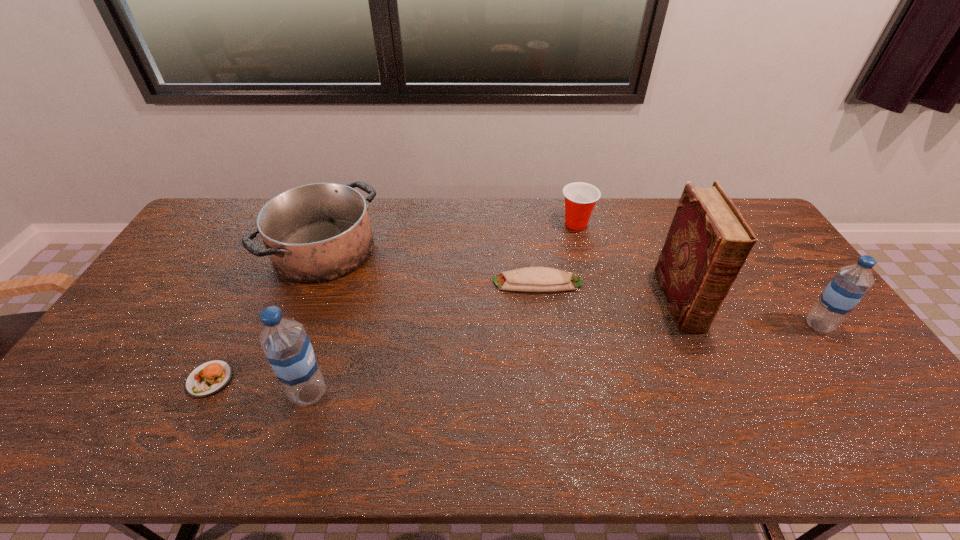
Locate an element on the screen. This screenshot has height=540, width=960. patty at the near edge is located at coordinates (207, 379).

Image resolution: width=960 pixels, height=540 pixels. Find the location of `object located in the right edge section of the desktop`. object located in the right edge section of the desktop is located at coordinates (850, 284).

Image resolution: width=960 pixels, height=540 pixels. I want to click on vacant space at the far edge of the desktop, so click(256, 207).

In the image, there is a desktop. Identify the location of free space at the near edge. This screenshot has height=540, width=960. (676, 412).

The image size is (960, 540). Find the location of `blank space at the left edge`. blank space at the left edge is located at coordinates (158, 295).

This screenshot has width=960, height=540. I want to click on vacant region at the far left corner, so click(221, 237).

Where is `free space between the burrito and the fourth tallest object`? Image resolution: width=960 pixels, height=540 pixels. free space between the burrito and the fourth tallest object is located at coordinates (431, 266).

Identify the location of vacant region between the farther water bottle and the taller water bottle. (564, 359).

Where is `free point between the taller water bottle and the burrito`? The height and width of the screenshot is (540, 960). free point between the taller water bottle and the burrito is located at coordinates (423, 338).

This screenshot has width=960, height=540. I want to click on vacant space in between the rightmost object and the patty, so click(515, 352).